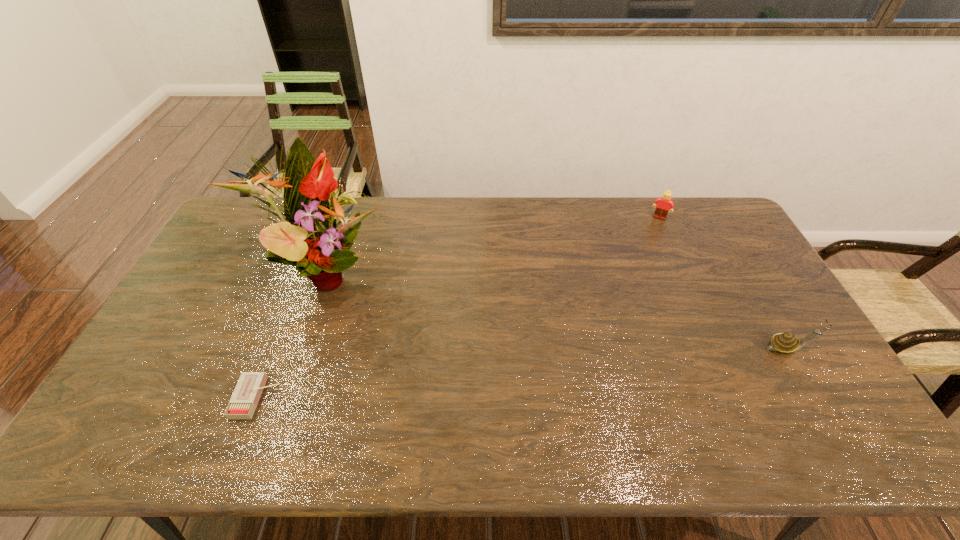
At what (x,y) coordinates should I click in order to perform the action: click on free space on the desktop that is between the nearest object and the third farthest object and is positioned on the face of the second object from right to left. Please return your answer as a coordinate pair (x, y). The image size is (960, 540). Looking at the image, I should click on (594, 366).

Find the location of a particular element. The height and width of the screenshot is (540, 960). vacant space on the desktop that is between the nearest object and the rightmost object and is positioned on the front-facing side of the third nearest object is located at coordinates (549, 370).